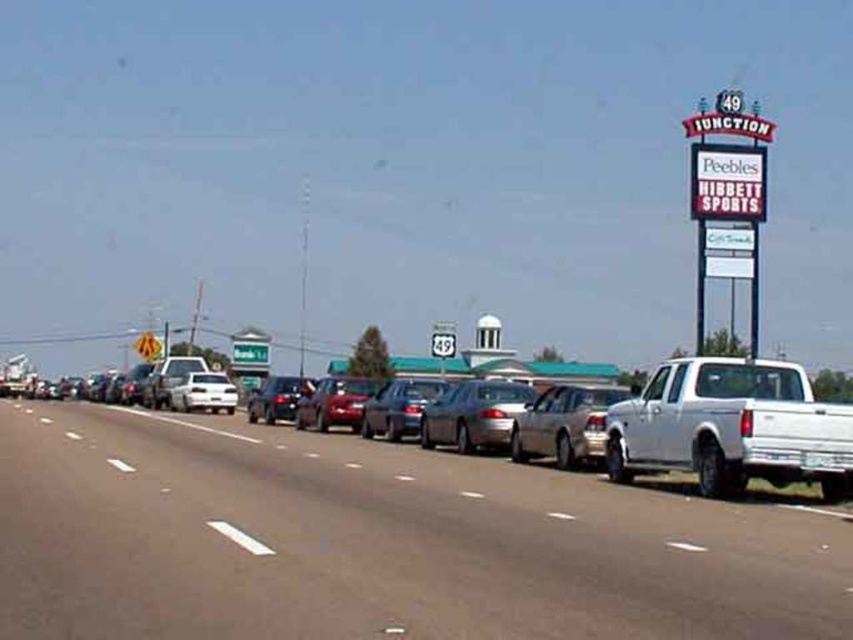
In the scene shown: You are standing on the road and looking towards the signpost. There are two points marked on the road ahead of you. The first point is at coordinates point (340, 390) and the second is at point (267, 352). Which point is closer to you?

Point (340, 390) is closer to the viewer than point (267, 352).

In the scene shown: You are driving a car and need to park in the parking lot near the signpost that says 49 Junction. The parking lot has a white matte sedan at center and a gray asphalt road at center. Which object should you avoid driving over to stay on the road?

You should avoid driving over the gray asphalt road at center because it is positioned on the right side of the white matte sedan at center, meaning the road is to the right of the sedan and staying on the road would require avoiding the sedan itself.